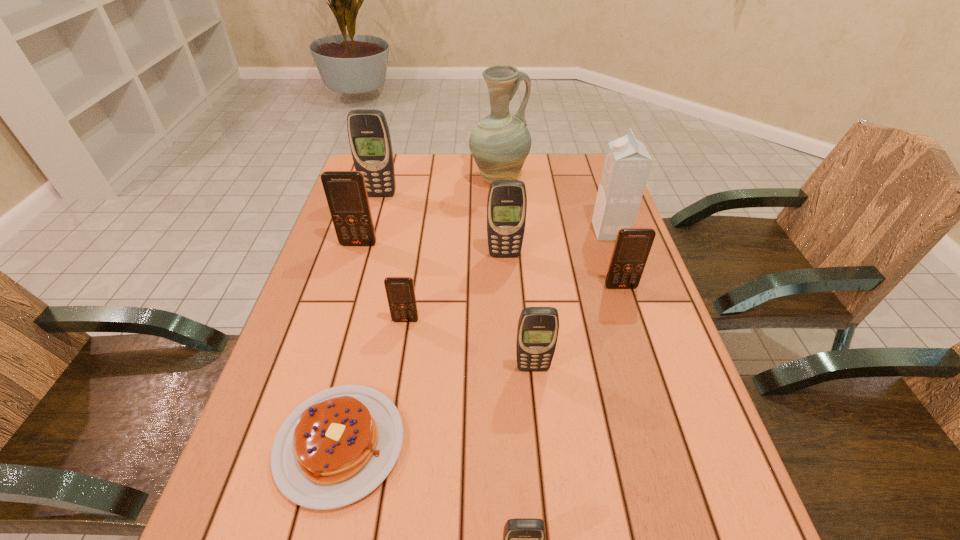
This screenshot has height=540, width=960. Find the location of `cellular telephone located at the right edge`. cellular telephone located at the right edge is located at coordinates (632, 246).

Identify the location of free location at the far edge. The width and height of the screenshot is (960, 540). (483, 184).

In the image, there is a desktop. At what (x,y) coordinates should I click in order to perform the action: click on free region at the left edge. Please return your answer as a coordinate pair (x, y). Image resolution: width=960 pixels, height=540 pixels. Looking at the image, I should click on (293, 343).

Image resolution: width=960 pixels, height=540 pixels. Identify the location of vacant space at the right edge of the desktop. (592, 284).

Locate an element on the screen. Image resolution: width=960 pixels, height=540 pixels. vacant space at the far left corner of the desktop is located at coordinates (403, 166).

At what (x,y) coordinates should I click in order to perform the action: click on vacant space in between the smallest orange cellular telephone and the third nearest gray cellular telephone. Please return your answer as a coordinate pair (x, y). This screenshot has height=540, width=960. Looking at the image, I should click on (455, 288).

Identify the location of unoccupied position between the third biggest gray cellular telephone and the carton. (571, 300).

Find the location of `free area in between the farthest orange cellular telephone and the carton`. free area in between the farthest orange cellular telephone and the carton is located at coordinates (485, 238).

The width and height of the screenshot is (960, 540). What are the coordinates of `empty location between the carton and the third farthest cellular telephone` in the screenshot? It's located at (557, 243).

At what (x,y) coordinates should I click in order to perform the action: click on vacant space that is in between the eighth farthest object and the farthest orange cellular telephone. Please return your answer as a coordinate pair (x, y). The image size is (960, 540). Looking at the image, I should click on (445, 306).